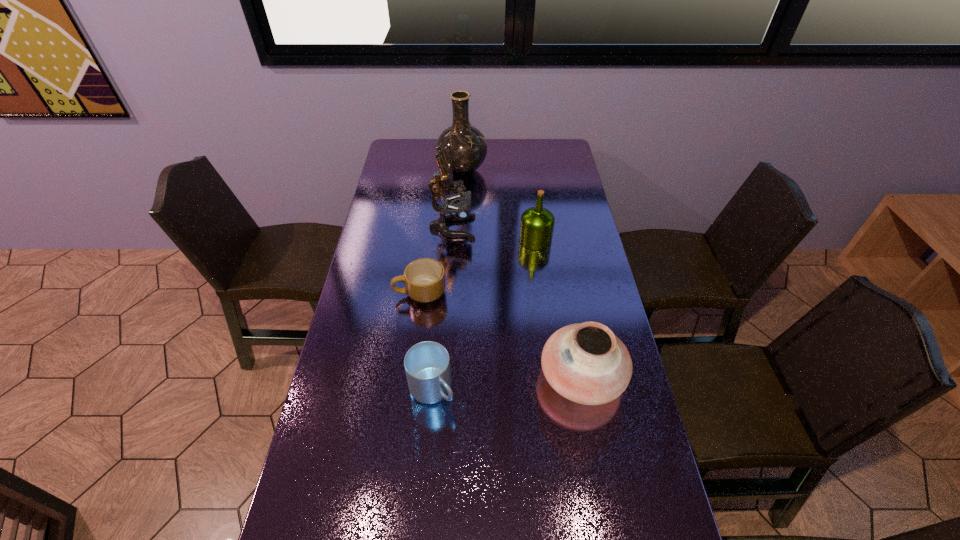
Identify which object is located as the third nearest to the fourth farthest object. Please provide its 2D coordinates. Your answer should be formatted as a tuple, i.e. [(x, y)], where the tuple contains the x and y coordinates of a point satisfying the conditions above.

[(537, 223)]

Find the location of a particular element. This screenshot has height=540, width=960. free spot that satisfies the following two spatial constraints: 1. on the side with the handle of the olive oil; 2. on the left side of the shorter mug is located at coordinates (426, 240).

At what (x,y) coordinates should I click in order to perform the action: click on free space that satisfies the following two spatial constraints: 1. at the eyepieces of the olive oil; 2. on the right side of the microscope. Please return your answer as a coordinate pair (x, y). Looking at the image, I should click on (451, 240).

The height and width of the screenshot is (540, 960). Find the location of `blank space that satisfies the following two spatial constraints: 1. on the side with the handle of the vase; 2. on the left side of the shortest object`. blank space that satisfies the following two spatial constraints: 1. on the side with the handle of the vase; 2. on the left side of the shortest object is located at coordinates (436, 170).

Locate an element on the screen. The width and height of the screenshot is (960, 540). free location that satisfies the following two spatial constraints: 1. on the front side of the olive oil; 2. on the right side of the pottery is located at coordinates (554, 376).

Locate an element on the screen. The height and width of the screenshot is (540, 960). vacant region that satisfies the following two spatial constraints: 1. on the side with the handle of the olive oil; 2. on the left side of the third nearest object is located at coordinates (426, 240).